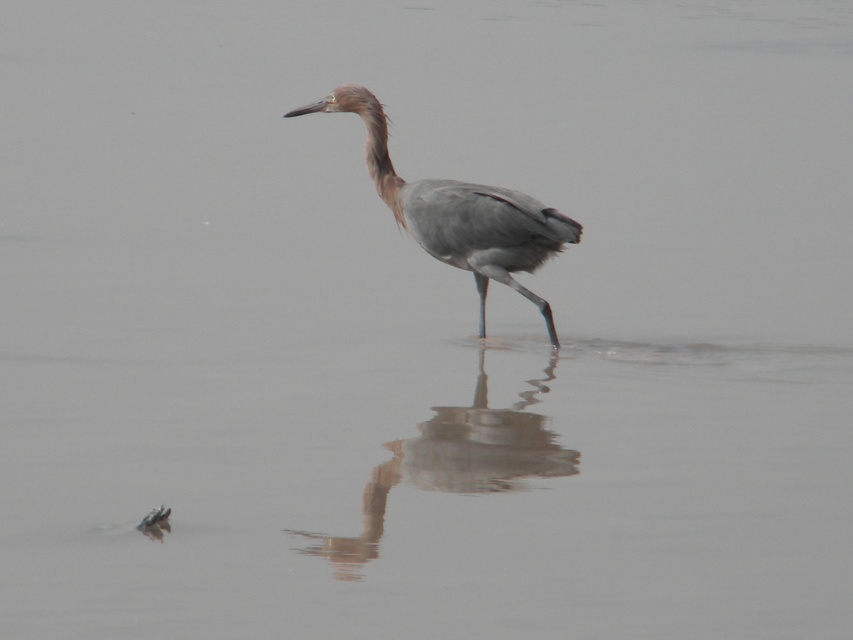
Question: Which of the following is the closest to the observer?

Choices:
 (A) (381, 170)
 (B) (367, 499)

Answer: (B)

Question: Does gray matte heron at center appear on the right side of smooth gray heron reflection at center?

Choices:
 (A) yes
 (B) no

Answer: (B)

Question: Does gray matte heron at center have a smaller size compared to smooth gray heron reflection at center?

Choices:
 (A) no
 (B) yes

Answer: (B)

Question: Observing the image, what is the correct spatial positioning of gray matte heron at center in reference to smooth gray heron reflection at center?

Choices:
 (A) left
 (B) right

Answer: (A)

Question: Which object appears farthest from the camera in this image?

Choices:
 (A) gray matte heron at center
 (B) smooth gray heron reflection at center

Answer: (A)